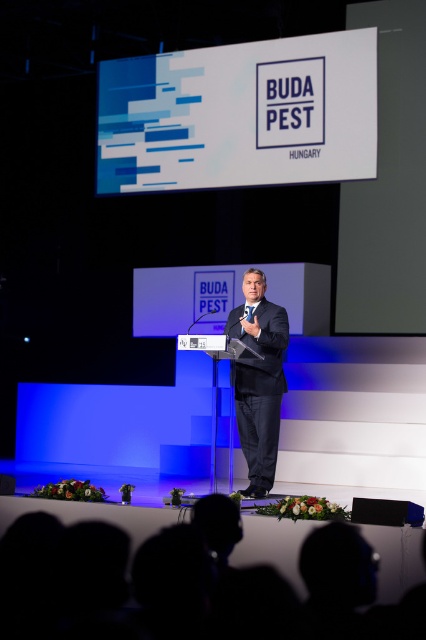
You are a photographer positioned at the front of the stage. You want to capture a photo that includes both point (x=201, y=166) and point (x=270, y=378). Which point should you focus on first to ensure both are in sharp focus?

You should focus on point (x=201, y=166) first because it is closer to the camera than point (x=270, y=378). This ensures that both points will be within the depth of field when focused on the closer point.

You are an event planner standing at the back of the stage and want to adjust the white matte sign at upper center and the dark suit at center. Which object should you approach first?

The white matte sign at upper center is closer to you than the dark suit at center, so you should approach the white matte sign at upper center first.